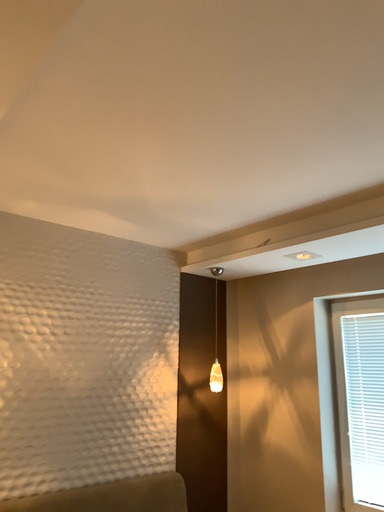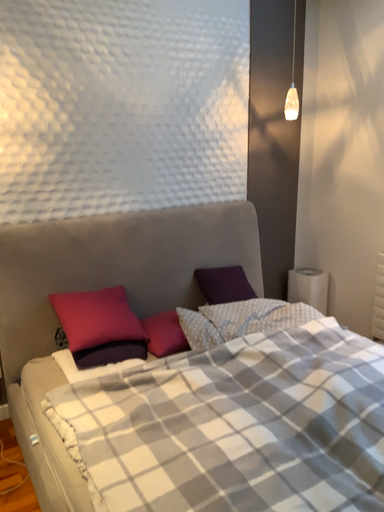
Question: How did the camera likely rotate when shooting the video?

Choices:
 (A) rotated upward
 (B) rotated downward

Answer: (B)